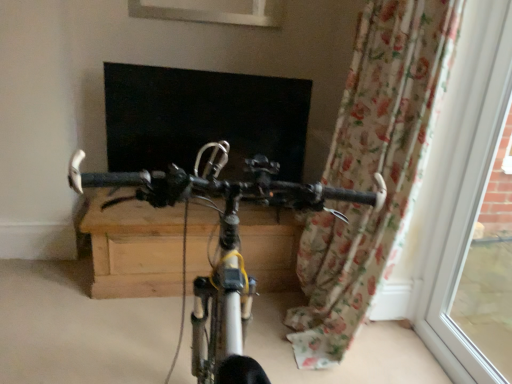
In order to face floral fabric curtain at right, should I rotate leftwards or rightwards?

Turn right approximately 12.187 degrees to face it.

Locate an element on the screen. white plastic window frame at right is located at coordinates (460, 184).

Where is `floral fabric curtain at right`? floral fabric curtain at right is located at coordinates (372, 169).

Considering the relative sizes of floral fabric curtain at right and white plastic window frame at right in the image provided, is floral fabric curtain at right wider than white plastic window frame at right?

Yes, floral fabric curtain at right is wider than white plastic window frame at right.

In the image, is floral fabric curtain at right positioned in front of or behind white plastic window frame at right?

In the image, floral fabric curtain at right appears behind white plastic window frame at right.

How distant is floral fabric curtain at right from white plastic window frame at right?

They are 14.35 inches apart.

Is floral fabric curtain at right oriented away from metallic silver bicycle at center?

That's not correct — floral fabric curtain at right is not looking away from metallic silver bicycle at center.

Between floral fabric curtain at right and metallic silver bicycle at center, which one has larger size?

With larger size is metallic silver bicycle at center.

Is floral fabric curtain at right behind metallic silver bicycle at center?

Yes, floral fabric curtain at right is further from the viewer.

From a real-world perspective, which is physically above, floral fabric curtain at right or metallic silver bicycle at center?

From a 3D spatial view, floral fabric curtain at right is above.

Can you confirm if metallic silver bicycle at center is thinner than floral fabric curtain at right?

Incorrect, the width of metallic silver bicycle at center is not less than that of floral fabric curtain at right.

Which object is further away from the camera taking this photo, metallic silver bicycle at center or floral fabric curtain at right?

floral fabric curtain at right is further away from the camera.

Are metallic silver bicycle at center and floral fabric curtain at right far apart?

metallic silver bicycle at center is near floral fabric curtain at right, not far away.

Which is behind, point (263, 176) or point (381, 56)?

Point (381, 56)

Is point (421, 241) more distant than point (357, 212)?

That is True.

From the picture: Can you confirm if white plastic window frame at right is thinner than floral fabric curtain at right?

Correct, the width of white plastic window frame at right is less than that of floral fabric curtain at right.

Considering the relative sizes of white plastic window frame at right and floral fabric curtain at right in the image provided, is white plastic window frame at right taller than floral fabric curtain at right?

Correct, white plastic window frame at right is much taller as floral fabric curtain at right.

Considering the sizes of metallic silver bicycle at center and white plastic window frame at right in the image, is metallic silver bicycle at center taller or shorter than white plastic window frame at right?

Considering their sizes, metallic silver bicycle at center has less height than white plastic window frame at right.

Looking at this image, from a real-world perspective, is metallic silver bicycle at center located higher than white plastic window frame at right?

No.

From the image's perspective, does metallic silver bicycle at center appear lower than white plastic window frame at right?

Yes, from the image's perspective, metallic silver bicycle at center is beneath white plastic window frame at right.

Is metallic silver bicycle at center not inside white plastic window frame at right?

Indeed, metallic silver bicycle at center is completely outside white plastic window frame at right.

Looking at this image, from a real-world perspective, between white plastic window frame at right and metallic silver bicycle at center, who is vertically higher?

In real-world perspective, white plastic window frame at right is above.

Does white plastic window frame at right have a lesser width compared to metallic silver bicycle at center?

Indeed, white plastic window frame at right has a lesser width compared to metallic silver bicycle at center.

What's the angular difference between white plastic window frame at right and metallic silver bicycle at center's facing directions?

89.6 degrees separate the facing orientations of white plastic window frame at right and metallic silver bicycle at center.

The height and width of the screenshot is (384, 512). Identify the location of curtain above the white plastic window frame at right (from the image's perspective). (372, 169).

Image resolution: width=512 pixels, height=384 pixels. I want to click on bicycle lying below the floral fabric curtain at right (from the image's perspective), so click(222, 245).

Estimate the real-world distances between objects in this image. Which object is further from metallic silver bicycle at center, floral fabric curtain at right or white plastic window frame at right?

white plastic window frame at right lies further to metallic silver bicycle at center than the other object.

Looking at the image, which one is located closer to white plastic window frame at right, floral fabric curtain at right or metallic silver bicycle at center?

floral fabric curtain at right is positioned closer to the anchor white plastic window frame at right.

From the image, which object appears to be farther from floral fabric curtain at right, white plastic window frame at right or metallic silver bicycle at center?

metallic silver bicycle at center.

From the picture: From the image, which object appears to be nearer to white plastic window frame at right, metallic silver bicycle at center or floral fabric curtain at right?

floral fabric curtain at right.

From the image, which object appears to be nearer to metallic silver bicycle at center, white plastic window frame at right or floral fabric curtain at right?

floral fabric curtain at right is closer to metallic silver bicycle at center.

Based on their spatial positions, is metallic silver bicycle at center or white plastic window frame at right further from floral fabric curtain at right?

The object further to floral fabric curtain at right is metallic silver bicycle at center.

Locate an element on the screen. curtain situated between metallic silver bicycle at center and white plastic window frame at right from left to right is located at coordinates (372, 169).